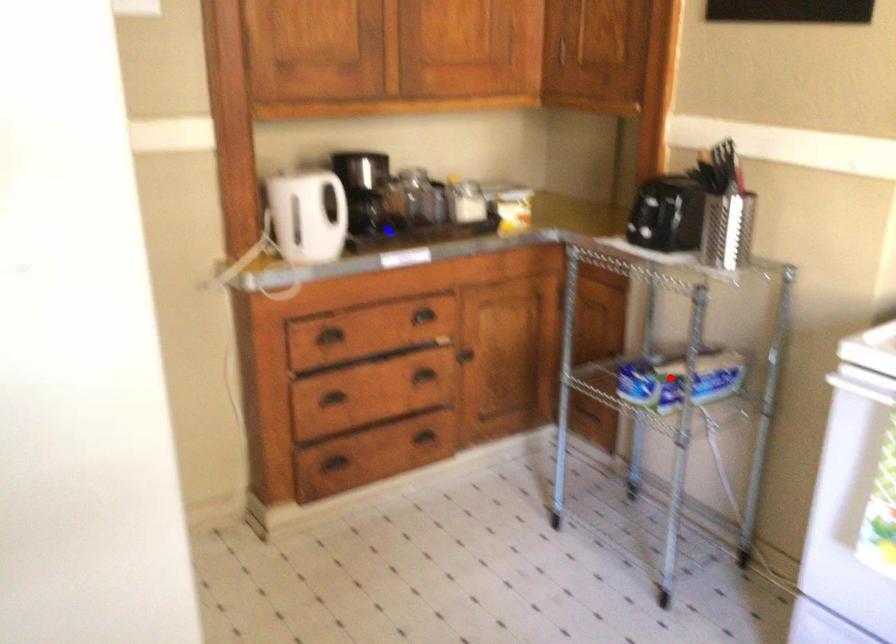
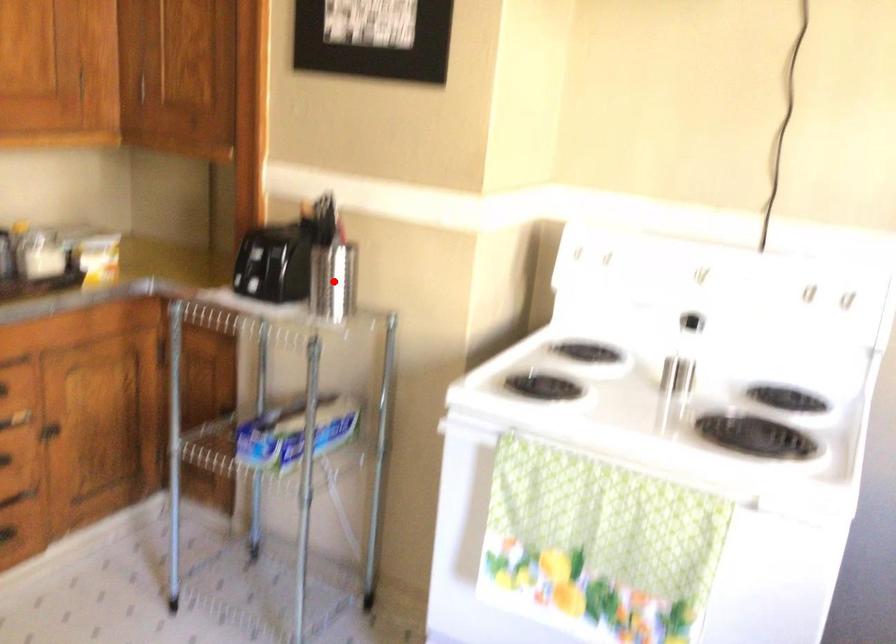
I am providing you with two images of the same scene from different viewpoints. A red point is marked on the first image and another point is marked on the second image. Is the marked point in image1 the same physical position as the marked point in image2?

No